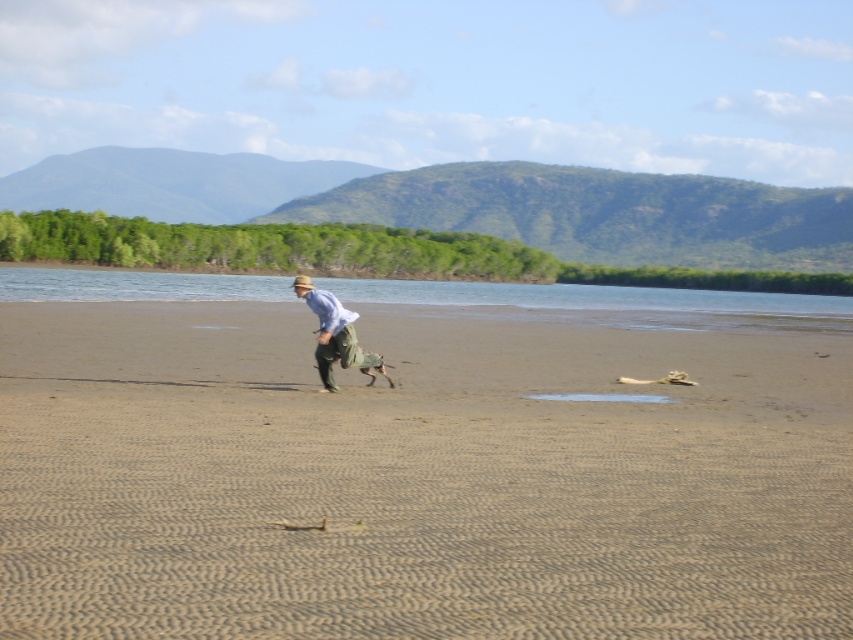
Consider the image. You are standing at the beach and see two points marked on the sand. The first point is at coordinates point (90, 362) and the second point is at point (351, 282). Which point is closer to you?

The point at (90, 362) is closer to you than the point at (351, 282).